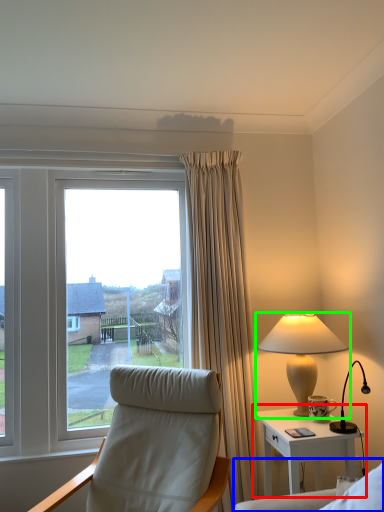
Question: Which object is the closest to the nightstand (highlighted by a red box)? Choose among these: couch (highlighted by a blue box) or lamp (highlighted by a green box).

Choices:
 (A) couch
 (B) lamp

Answer: (B)